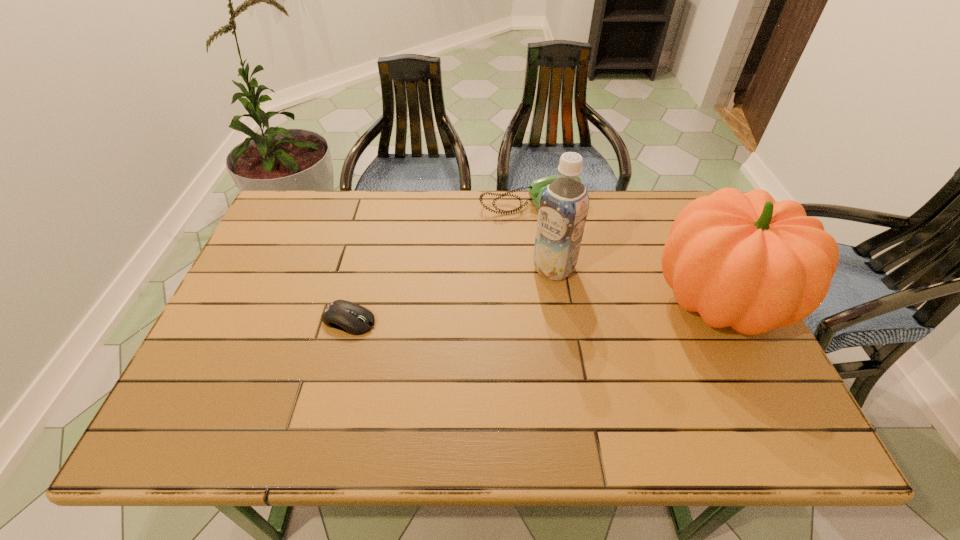
This screenshot has height=540, width=960. I want to click on vacant space that is in between the leftmost object and the telephone, so click(x=440, y=262).

Locate an element on the screen. Image resolution: width=960 pixels, height=540 pixels. vacant space that is in between the pumpkin and the soya milk is located at coordinates (636, 285).

Where is `the closest object relative to the telephone`? The image size is (960, 540). the closest object relative to the telephone is located at coordinates (564, 204).

Image resolution: width=960 pixels, height=540 pixels. In order to click on the second closest object to the third tallest object in this screenshot , I will do `click(747, 261)`.

Find the location of a particular element. This screenshot has height=540, width=960. vacant space that satisfies the following two spatial constraints: 1. on the front side of the rightmost object; 2. on the right side of the soya milk is located at coordinates (560, 301).

In order to click on vacant space that satisfies the following two spatial constraints: 1. on the front side of the third tallest object; 2. on the right side of the pumpkin in this screenshot , I will do `click(543, 301)`.

This screenshot has height=540, width=960. Find the location of `vacant area in the image that satisfies the following two spatial constraints: 1. on the front side of the farthest object; 2. on the right side of the rightmost object`. vacant area in the image that satisfies the following two spatial constraints: 1. on the front side of the farthest object; 2. on the right side of the rightmost object is located at coordinates (543, 301).